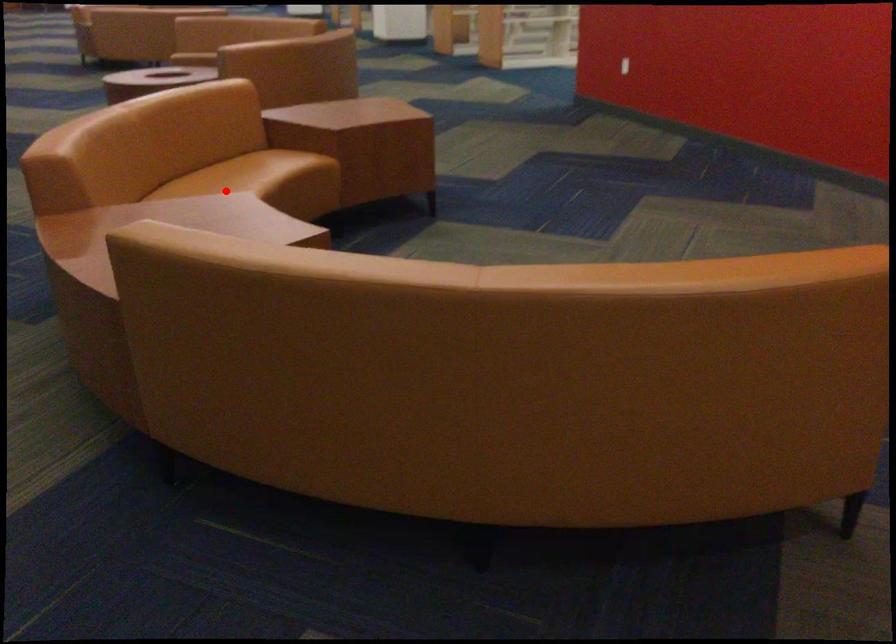
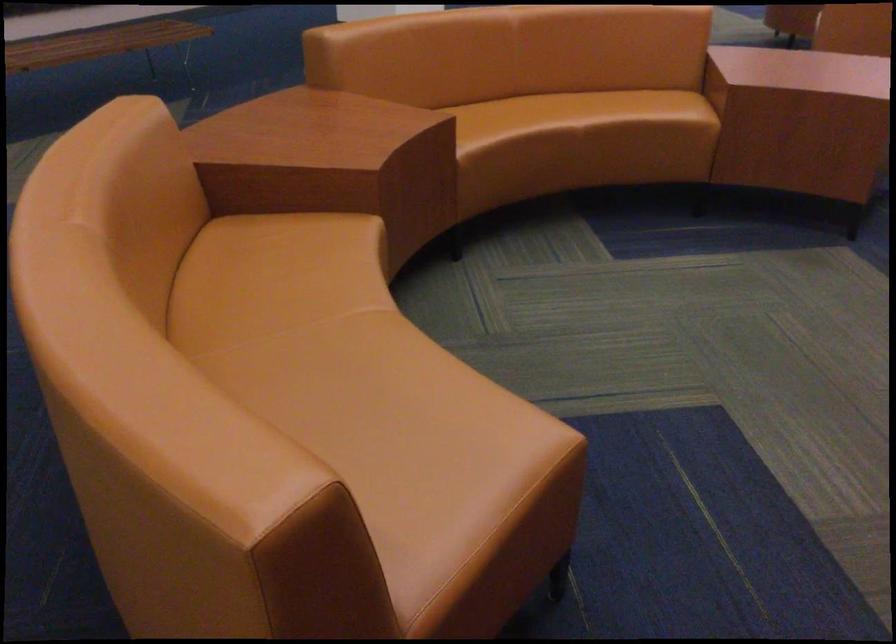
Question: I am providing you with two images of the same scene from different viewpoints. Given a red point in image1, look at the same physical point in image2. Is it:

Choices:
 (A) Closer to the viewpoint
 (B) Farther from the viewpoint

Answer: (A)